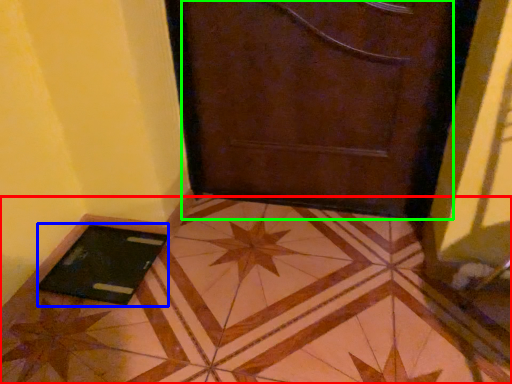
Question: Based on their relative distances, which object is nearer to tile (highlighted by a red box)? Choose from tablet computer (highlighted by a blue box) and door (highlighted by a green box).

Choices:
 (A) tablet computer
 (B) door

Answer: (A)